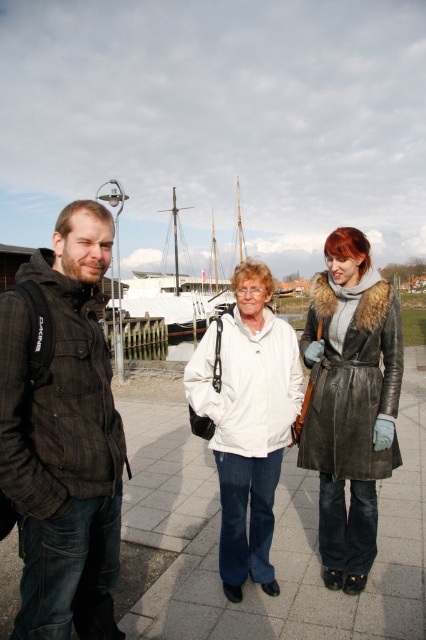
Which is below, dark brown plaid jacket at left or white matte jacket at center?

white matte jacket at center is lower down.

Between point (74, 548) and point (230, 358), which one is positioned behind?

The point (230, 358) is more distant.

Between point (85, 387) and point (284, 356), which one is positioned behind?

The point (284, 356) is behind.

This screenshot has width=426, height=640. I want to click on dark brown plaid jacket at left, so click(63, 436).

Locate an element on the screen. The height and width of the screenshot is (640, 426). dark brown plaid jacket at left is located at coordinates (63, 436).

Does dark brown plaid jacket at left appear over leather coat at center?

No, dark brown plaid jacket at left is not above leather coat at center.

Identify the location of dark brown plaid jacket at left. The width and height of the screenshot is (426, 640). (63, 436).

Measure the distance between leather coat at center and white matte jacket at center.

A distance of 16.82 inches exists between leather coat at center and white matte jacket at center.

From the picture: Which of these two, leather coat at center or white matte jacket at center, stands shorter?

white matte jacket at center

Is point (311, 346) positioned in front of point (233, 516)?

No, it is not.

The image size is (426, 640). Identify the location of leather coat at center. (351, 403).